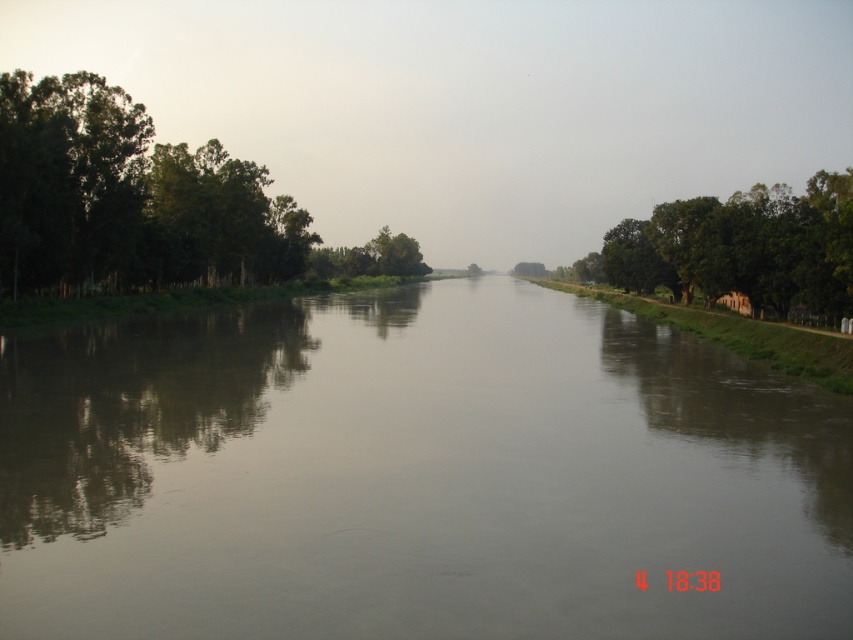
You are standing at the riverbank and want to cross to the other side. You see the green leafy trees at right and the green leafy tree at center. Which group of trees has a wider spread when viewed from above?

The green leafy trees at right has a larger width than the green leafy tree at center, so the group of green leafy trees at right has a wider spread when viewed from above.

You are standing at the riverbank and see two points marked on the image. Which point, point (x=679, y=230) or point (x=381, y=237), is closer to you?

Point (x=679, y=230) is closer to the viewer than point (x=381, y=237).

You are standing on the riverbank and want to cross the river using a small wooden plank. The plank is exactly as wide as the green leafy trees at right. Will the plank be wide enough to cover the brown smooth water at center?

The brown smooth water at center is narrower than the green leafy trees at right, so the plank, which is as wide as the green leafy trees at right, will be wide enough to cover the brown smooth water at center.